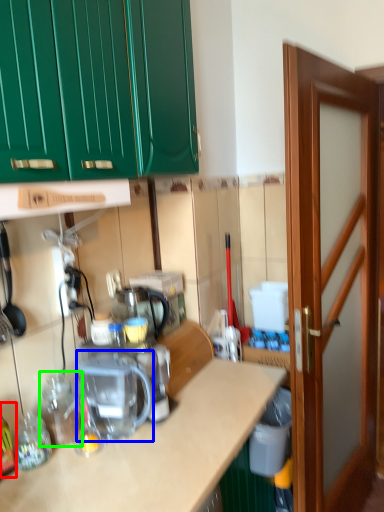
Question: Which object is positioned farthest from bottle (highlighted by a red box)? Select from coffee machine (highlighted by a blue box) and bottle (highlighted by a green box).

Choices:
 (A) coffee machine
 (B) bottle

Answer: (A)